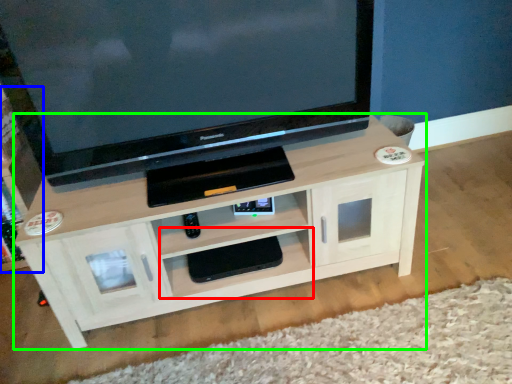
Question: Estimate the real-world distances between objects in this image. Which object is closer to shelf (highlighted by a red box), tv cabinet (highlighted by a blue box) or shelf (highlighted by a green box)?

Choices:
 (A) tv cabinet
 (B) shelf

Answer: (B)